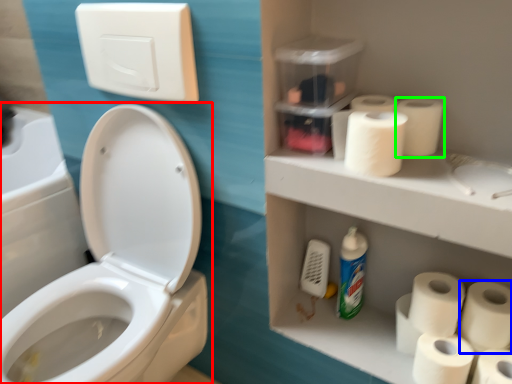
Question: Which object is positioned farthest from toilet (highlighted by a red box)? Select from toilet paper (highlighted by a blue box) and toilet paper (highlighted by a green box).

Choices:
 (A) toilet paper
 (B) toilet paper

Answer: (A)